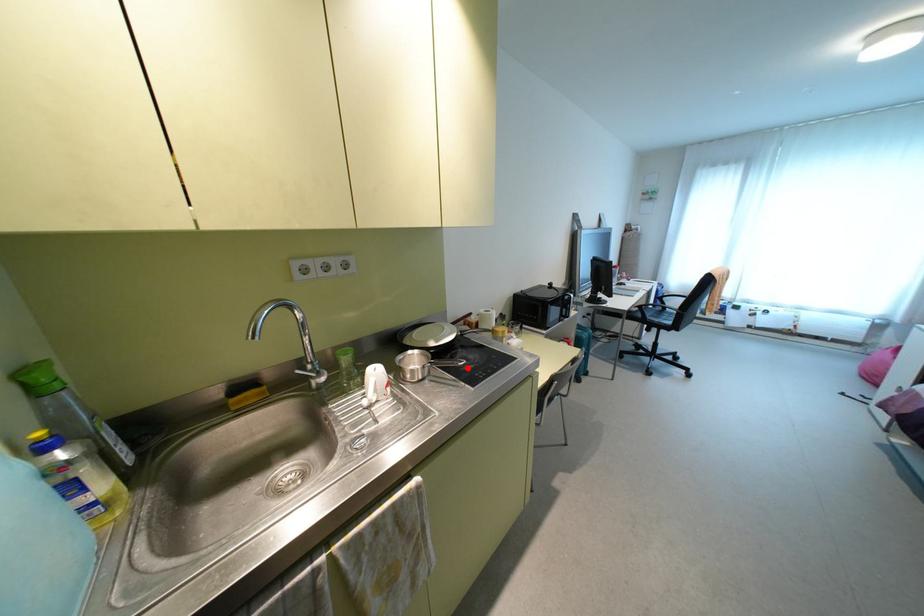
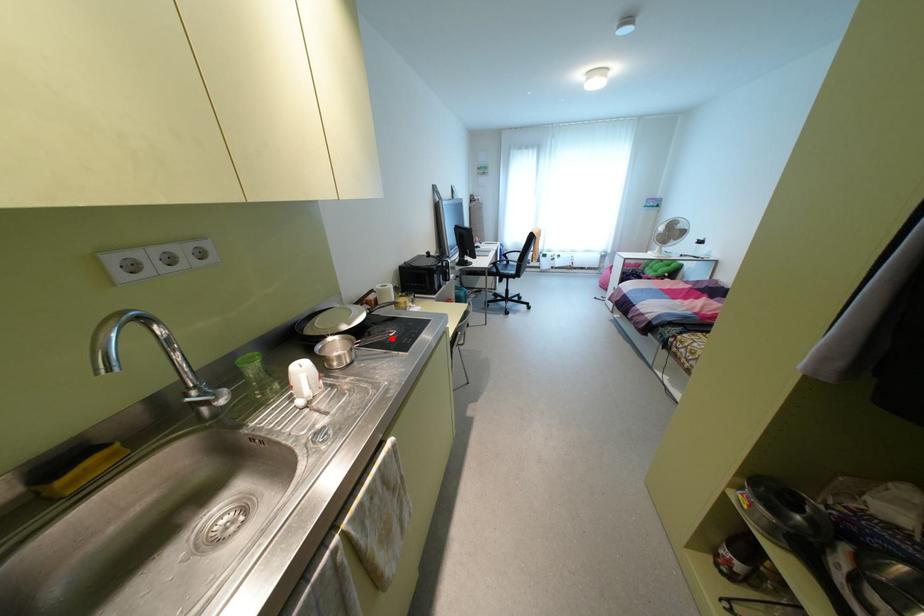
I am providing you with two images of the same scene from different viewpoints. A red point is marked on the first image and another point is marked on the second image. Are the points marked in image1 and image2 representing the same 3D position?

Yes